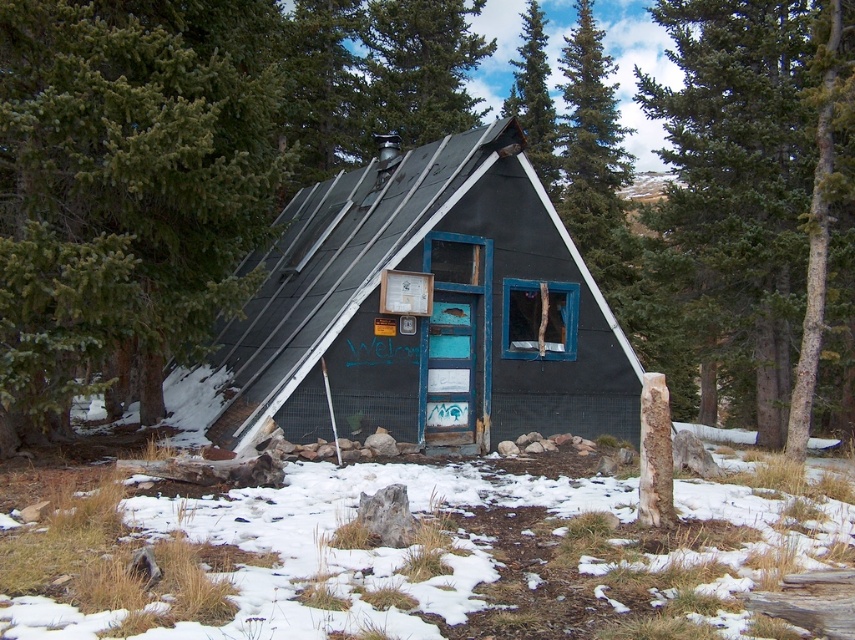
Question: Which point is closer to the camera?

Choices:
 (A) green textured tree at upper right
 (B) matte black cabin at center
 (C) white powdery snow at center

Answer: (C)

Question: Which object is the closest to the green leafy tree at upper center?

Choices:
 (A) green textured tree at upper right
 (B) matte black cabin at center

Answer: (A)

Question: Which object is the farthest from the green pine tree at upper center?

Choices:
 (A) green textured tree at upper right
 (B) matte black cabin at center
 (C) green needle-like leaves at upper left
 (D) green leafy tree at upper center

Answer: (C)

Question: Is the position of white powdery snow at center more distant than that of green leafy tree at upper center?

Choices:
 (A) yes
 (B) no

Answer: (B)

Question: Does white powdery snow at center come behind green leafy tree at upper center?

Choices:
 (A) yes
 (B) no

Answer: (B)

Question: Considering the relative positions of green textured tree at upper right and green leafy tree at upper center in the image provided, where is green textured tree at upper right located with respect to green leafy tree at upper center?

Choices:
 (A) right
 (B) left

Answer: (A)